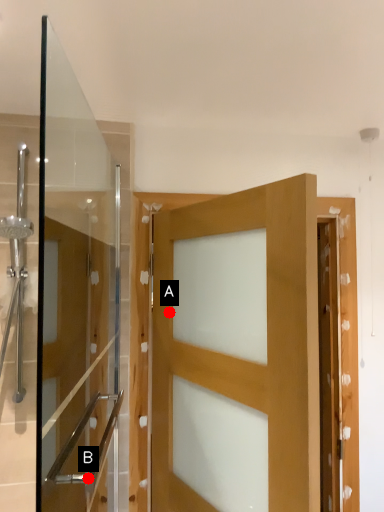
Question: Two points are circled on the image, labeled by A and B beside each circle. Which of the following is the farthest from the observer?

Choices:
 (A) A is further
 (B) B is further

Answer: (B)